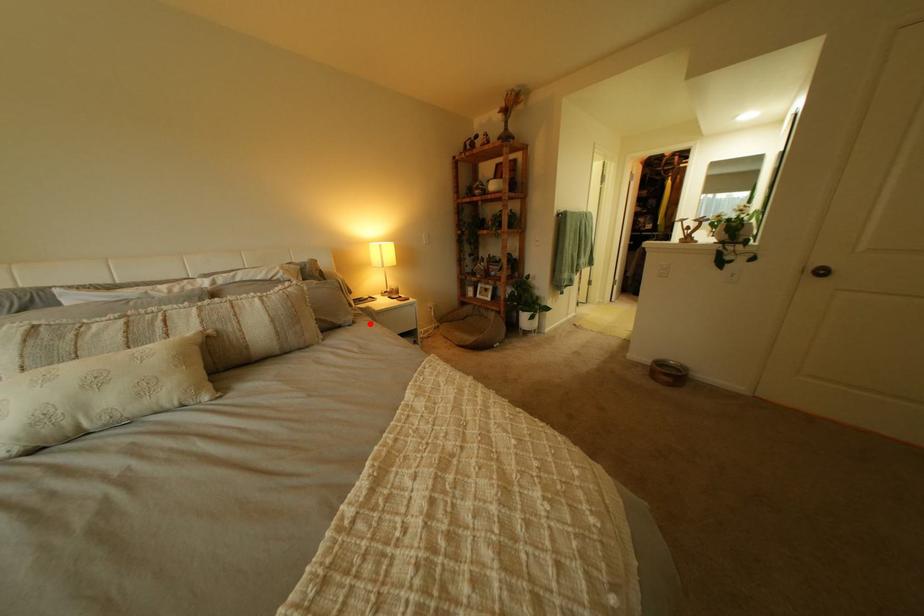
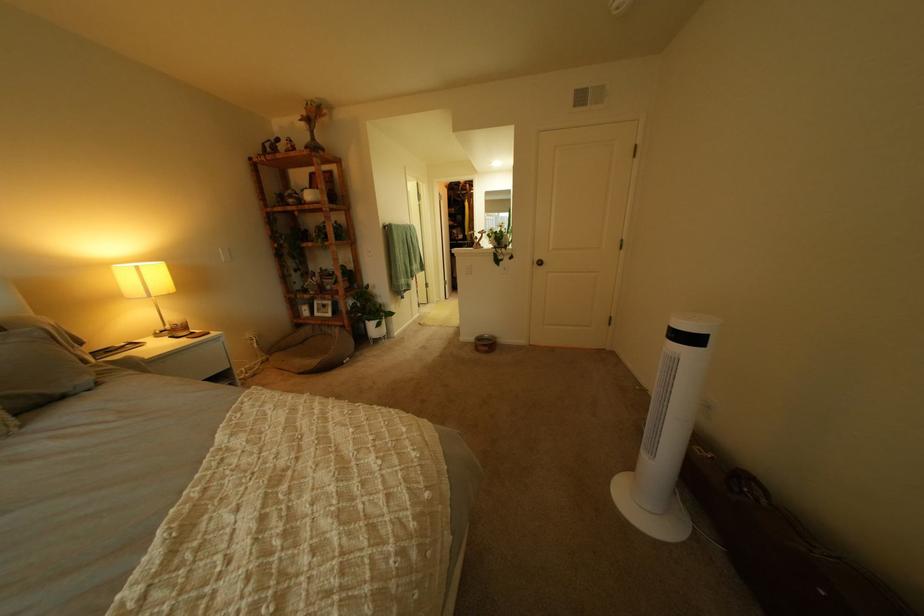
The point at the highlighted location is marked in the first image. Where is the corresponding point in the second image?

(115, 385)